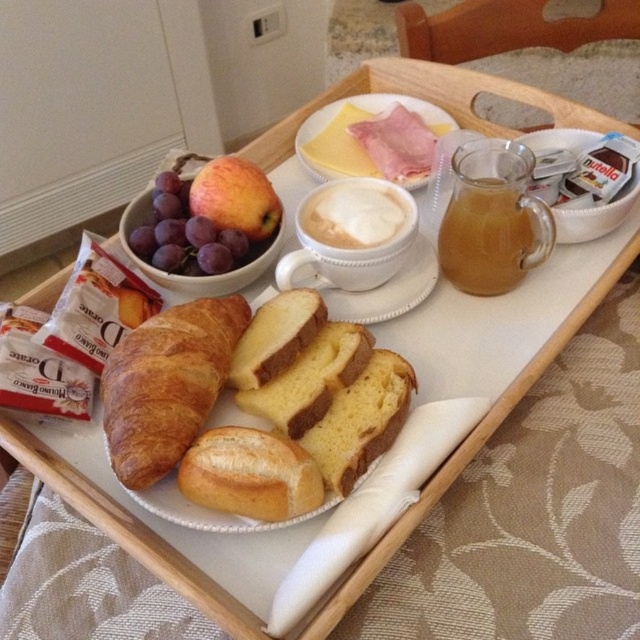
Who is higher up, golden soft bread at center or shiny purple grapes at upper left?

Positioned higher is shiny purple grapes at upper left.

What do you see at coordinates (362, 420) in the screenshot?
I see `golden soft bread at center` at bounding box center [362, 420].

Image resolution: width=640 pixels, height=640 pixels. In order to click on golden soft bread at center in this screenshot , I will do `click(362, 420)`.

Locate an element on the screen. The width and height of the screenshot is (640, 640). golden soft bread at center is located at coordinates (362, 420).

From the picture: Does golden brown croissant at left have a lesser height compared to shiny purple grapes at upper left?

Incorrect, golden brown croissant at left's height does not fall short of shiny purple grapes at upper left's.

Is golden brown croissant at left below shiny purple grapes at upper left?

Correct, golden brown croissant at left is located below shiny purple grapes at upper left.

Where is `golden brown croissant at left`? The image size is (640, 640). golden brown croissant at left is located at coordinates (166, 385).

Who is lower down, golden brown croissant at left or golden crusty bread at center?

golden crusty bread at center

Does golden brown croissant at left have a lesser width compared to golden crusty bread at center?

No.

Is point (234, 316) positioned after point (268, 493)?

Yes, it is.

You are a GUI agent. You are given a task and a screenshot of the screen. Output one action in this format:
    pyautogui.click(x=<x>, y=<y>)
    Task: Click on the golden brown croissant at left
    The width and height of the screenshot is (640, 640).
    Given the screenshot: What is the action you would take?
    pyautogui.click(x=166, y=385)